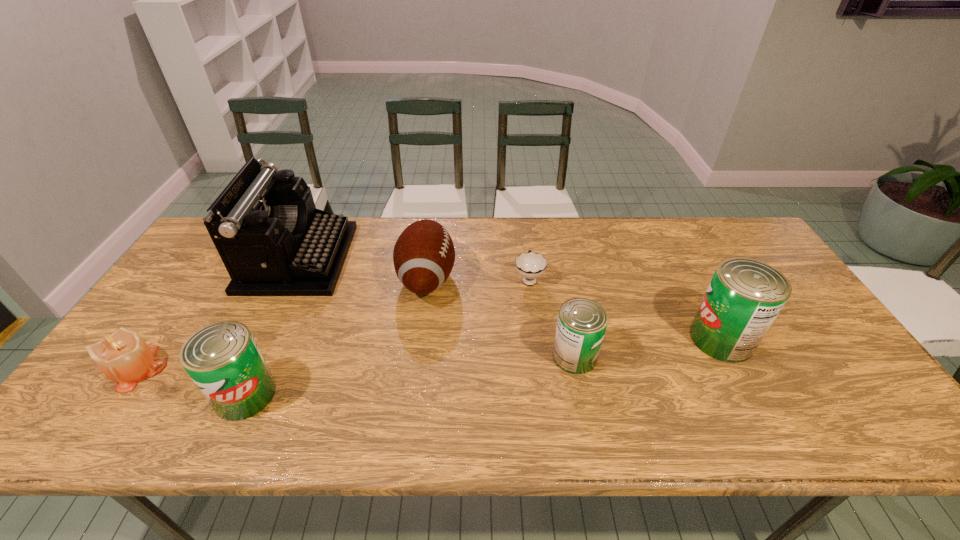
This screenshot has width=960, height=540. I want to click on free spot located on the side of the shortest object with the handle, so click(x=524, y=242).

Where is `free space located 0.260m on the side of the shortest object with the handle`? free space located 0.260m on the side of the shortest object with the handle is located at coordinates (521, 218).

Find the location of a particular element. vacant area located 0.180m on the side of the shortest object with the handle is located at coordinates (523, 231).

You are a GUI agent. You are given a task and a screenshot of the screen. Output one action in this format:
    pyautogui.click(x=<x>, y=<y>)
    Task: Click on the free space located on the typing side of the typewriter
    The image size is (960, 540).
    Given the screenshot: What is the action you would take?
    tap(394, 258)

In order to click on free location located 0.230m on the laces of the fourth object from left to right in this screenshot , I will do `click(533, 278)`.

Where is `free space located on the right of the candle`? free space located on the right of the candle is located at coordinates (328, 368).

You are a GUI agent. You are given a task and a screenshot of the screen. Output one action in this format:
    pyautogui.click(x=<x>, y=<y>)
    Task: Click on the typewriter at the far edge
    
    Given the screenshot: What is the action you would take?
    pyautogui.click(x=273, y=241)

Find the location of a particular element. The image size is (960, 540). football present at the far edge is located at coordinates (424, 254).

This screenshot has height=540, width=960. I want to click on candle at the near edge, so 123,356.

This screenshot has height=540, width=960. Find the location of `object located in the left edge section of the desktop`. object located in the left edge section of the desktop is located at coordinates (123, 356).